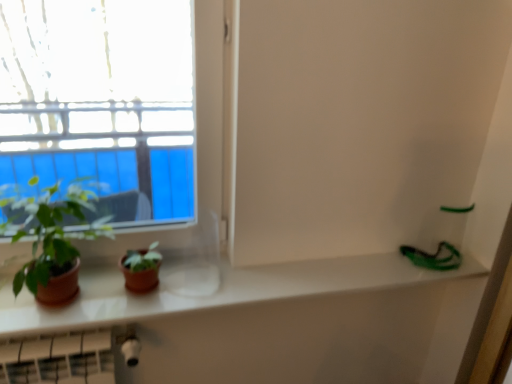
Describe the element at coordinates (53, 240) in the screenshot. I see `green matte plant at left` at that location.

Image resolution: width=512 pixels, height=384 pixels. Identify the location of green matte plant at left. (53, 240).

The image size is (512, 384). What do you see at coordinates (215, 292) in the screenshot?
I see `white glossy counter top at center` at bounding box center [215, 292].

Locate an element on the screen. The width and height of the screenshot is (512, 384). white glossy counter top at center is located at coordinates (215, 292).

I want to click on green matte plant at left, so click(53, 240).

In the image, is green matte plant at left on the left side or the right side of white glossy counter top at center?

From the image, it's evident that green matte plant at left is to the left of white glossy counter top at center.

Is the position of green matte plant at left less distant than that of white glossy counter top at center?

Yes, green matte plant at left is closer to the camera.

Does point (38, 290) appear closer or farther from the camera than point (381, 276)?

Point (38, 290) is positioned closer to the camera compared to point (381, 276).

From the image's perspective, relative to white glossy counter top at center, is green matte plant at left above or below?

From the image's perspective, green matte plant at left appears above white glossy counter top at center.

From a real-world perspective, who is located higher, green matte plant at left or white glossy counter top at center?

In real-world perspective, green matte plant at left is above.

In terms of width, does green matte plant at left look wider or thinner when compared to white glossy counter top at center?

Clearly, green matte plant at left has less width compared to white glossy counter top at center.

Who is taller, green matte plant at left or white glossy counter top at center?

Standing taller between the two is green matte plant at left.

Considering the relative sizes of green matte plant at left and white glossy counter top at center in the image provided, is green matte plant at left smaller than white glossy counter top at center?

Actually, green matte plant at left might be larger than white glossy counter top at center.

Would you say green matte plant at left contains white glossy counter top at center?

Actually, white glossy counter top at center is outside green matte plant at left.

Is green matte plant at left in contact with white glossy counter top at center?

No, green matte plant at left is not beside white glossy counter top at center.

Is green matte plant at left oriented towards white glossy counter top at center?

No, green matte plant at left is not facing towards white glossy counter top at center.

Measure the distance from green matte plant at left to white glossy counter top at center.

They are 12.37 inches apart.

This screenshot has width=512, height=384. I want to click on houseplant on the left of white glossy counter top at center, so click(x=53, y=240).

Visually, is white glossy counter top at center positioned to the left or to the right of green matte plant at left?

Clearly, white glossy counter top at center is on the right of green matte plant at left in the image.

Considering their positions, is white glossy counter top at center located in front of or behind green matte plant at left?

Clearly, white glossy counter top at center is behind green matte plant at left.

Which point is more distant from viewer, (326, 292) or (72, 238)?

Point (326, 292)

From the image's perspective, between white glossy counter top at center and green matte plant at left, which one is located above?

green matte plant at left is shown above in the image.

Consider the image. From a real-world perspective, relative to green matte plant at left, is white glossy counter top at center vertically above or below?

white glossy counter top at center is below green matte plant at left.

Considering the sizes of white glossy counter top at center and green matte plant at left in the image, is white glossy counter top at center wider or thinner than green matte plant at left?

Considering their sizes, white glossy counter top at center looks broader than green matte plant at left.

Which of these two, white glossy counter top at center or green matte plant at left, stands shorter?

white glossy counter top at center.

Between white glossy counter top at center and green matte plant at left, which one has larger size?

green matte plant at left.

Would you say green matte plant at left is part of white glossy counter top at center's contents?

No, green matte plant at left is not inside white glossy counter top at center.

Are white glossy counter top at center and green matte plant at left located far from each other?

That's not correct — white glossy counter top at center is a little close to green matte plant at left.

Is white glossy counter top at center oriented away from green matte plant at left?

white glossy counter top at center does not have its back to green matte plant at left.

How many degrees apart are the facing directions of white glossy counter top at center and green matte plant at left?

1.6 degrees.

Find the location of a particular element. Image resolution: width=512 pixels, height=384 pixels. houseplant that is above the white glossy counter top at center (from a real-world perspective) is located at coordinates (x=53, y=240).

Locate an element on the screen. houseplant located above the white glossy counter top at center (from the image's perspective) is located at coordinates (53, 240).

Locate an element on the screen. houseplant on the left of the white glossy counter top at center is located at coordinates (53, 240).